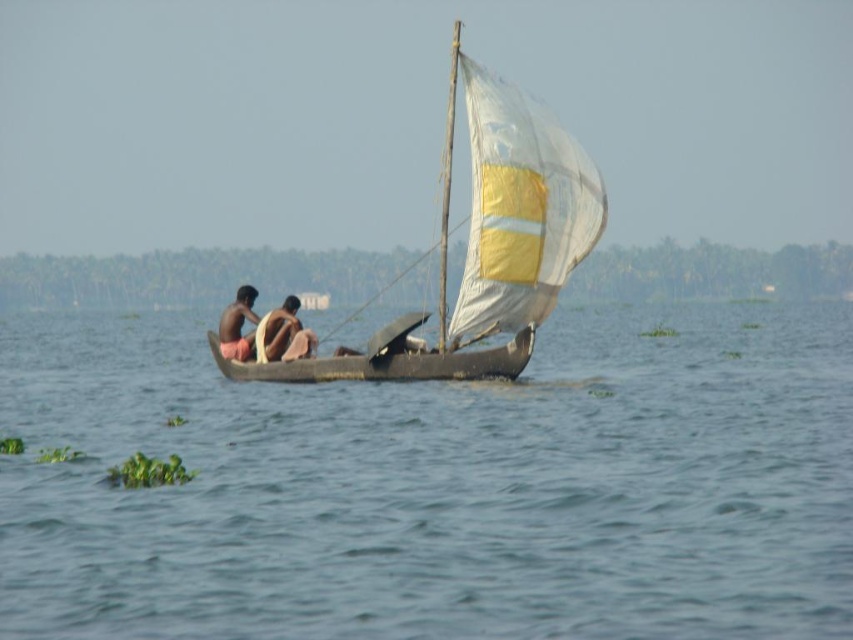
Can you confirm if white fabric sailboat at center is positioned to the left of brown skin person at center?

Incorrect, white fabric sailboat at center is not on the left side of brown skin person at center.

I want to click on white fabric sailboat at center, so click(x=483, y=244).

Is point (370, 358) behind point (256, 326)?

No, it is in front of (256, 326).

I want to click on white fabric sailboat at center, so click(483, 244).

Is dark brown wood canoe at center positioned at the back of brown skin person at center?

No, dark brown wood canoe at center is closer to the viewer.

Which of these two, dark brown wood canoe at center or brown skin person at center, stands shorter?

dark brown wood canoe at center

Describe the element at coordinates (386, 364) in the screenshot. I see `dark brown wood canoe at center` at that location.

Image resolution: width=853 pixels, height=640 pixels. I want to click on dark brown wood canoe at center, so click(x=386, y=364).

You are a GUI agent. You are given a task and a screenshot of the screen. Output one action in this format:
    pyautogui.click(x=<x>, y=<y>)
    Task: Click on the blue water at center
    This screenshot has width=853, height=640.
    Given the screenshot: What is the action you would take?
    (438, 486)

You are a GUI agent. You are given a task and a screenshot of the screen. Output one action in this format:
    pyautogui.click(x=<x>, y=<y>)
    Task: Click on the blue water at center
    The image size is (853, 640).
    Given the screenshot: What is the action you would take?
    pyautogui.click(x=438, y=486)